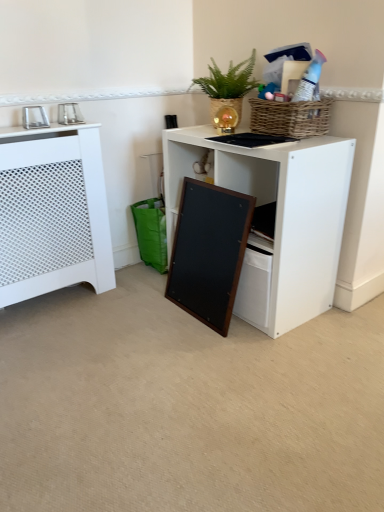
I want to click on vacant space in between metallic silver photo frame at upper left, the first appliance viewed from the left, and metallic silver photo frame at upper left, the 2th appliance when ordered from left to right, so click(x=56, y=130).